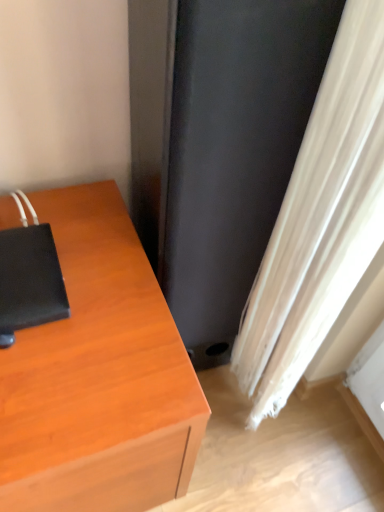
Question: Could you tell me if black matte notebook at left is turned towards white textured curtain at lower right?

Choices:
 (A) no
 (B) yes

Answer: (A)

Question: Does black matte notebook at left come behind white textured curtain at lower right?

Choices:
 (A) no
 (B) yes

Answer: (B)

Question: Is black matte notebook at left closer to camera compared to white textured curtain at lower right?

Choices:
 (A) yes
 (B) no

Answer: (B)

Question: Considering the relative positions of black matte notebook at left and white textured curtain at lower right in the image provided, is black matte notebook at left to the left of white textured curtain at lower right from the viewer's perspective?

Choices:
 (A) yes
 (B) no

Answer: (A)

Question: Is black matte notebook at left bigger than white textured curtain at lower right?

Choices:
 (A) no
 (B) yes

Answer: (A)

Question: Choose the correct answer: Is white textured curtain at lower right inside black matte screen door at center or outside it?

Choices:
 (A) outside
 (B) inside

Answer: (A)

Question: In terms of height, does white textured curtain at lower right look taller or shorter compared to black matte screen door at center?

Choices:
 (A) tall
 (B) short

Answer: (A)

Question: From a real-world perspective, relative to black matte screen door at center, is white textured curtain at lower right vertically above or below?

Choices:
 (A) above
 (B) below

Answer: (A)

Question: In the image, is white textured curtain at lower right positioned in front of or behind black matte screen door at center?

Choices:
 (A) behind
 (B) front

Answer: (B)

Question: In the image, is black matte screen door at center positioned in front of or behind white textured curtain at lower right?

Choices:
 (A) front
 (B) behind

Answer: (B)

Question: From a real-world perspective, is black matte screen door at center physically located above or below white textured curtain at lower right?

Choices:
 (A) below
 (B) above

Answer: (A)

Question: Is black matte screen door at center taller or shorter than white textured curtain at lower right?

Choices:
 (A) tall
 (B) short

Answer: (B)

Question: Considering the positions of black matte screen door at center and white textured curtain at lower right in the image, is black matte screen door at center bigger or smaller than white textured curtain at lower right?

Choices:
 (A) small
 (B) big

Answer: (B)

Question: In the image, is black matte notebook at left positioned in front of or behind white textured curtain at lower right?

Choices:
 (A) behind
 (B) front

Answer: (A)

Question: Is black matte notebook at left bigger or smaller than white textured curtain at lower right?

Choices:
 (A) small
 (B) big

Answer: (A)